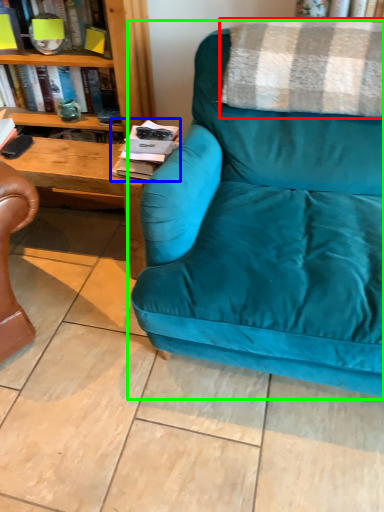
Question: Estimate the real-world distances between objects in this image. Which object is farther from blanket (highlighted by a red box), magazine (highlighted by a blue box) or studio couch (highlighted by a green box)?

Choices:
 (A) magazine
 (B) studio couch

Answer: (A)